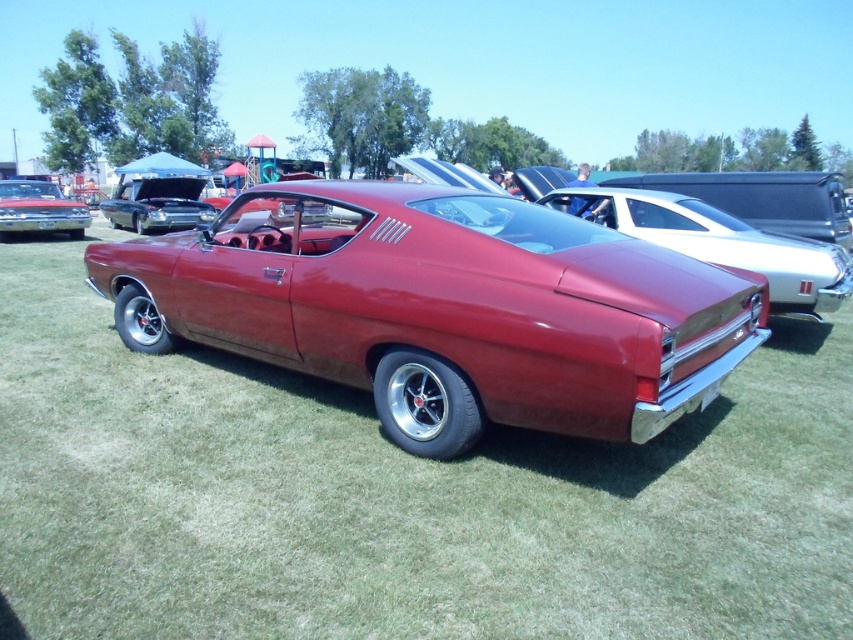
Is glossy red car at center below shiny red car at center?

Correct, glossy red car at center is located below shiny red car at center.

In the scene shown: Measure the distance between point (828, 438) and camera.

Point (828, 438) is 13.40 feet from camera.

The image size is (853, 640). I want to click on glossy red car at center, so click(x=397, y=497).

How much distance is there between glossy red car at center and glossy metallic car at center?

glossy red car at center is 20.97 feet away from glossy metallic car at center.

The width and height of the screenshot is (853, 640). Find the location of `glossy red car at center`. glossy red car at center is located at coordinates (397, 497).

Is point (74, 556) positioned after point (793, 257)?

No, it is not.

The image size is (853, 640). Identify the location of glossy red car at center. (397, 497).

Does shiny red car at center lie in front of glossy metallic car at center?

Yes, shiny red car at center is closer to the viewer.

Can you confirm if shiny red car at center is taller than glossy metallic car at center?

Yes, shiny red car at center is taller than glossy metallic car at center.

Describe the element at coordinates (444, 308) in the screenshot. I see `shiny red car at center` at that location.

Image resolution: width=853 pixels, height=640 pixels. Identify the location of shiny red car at center. (444, 308).